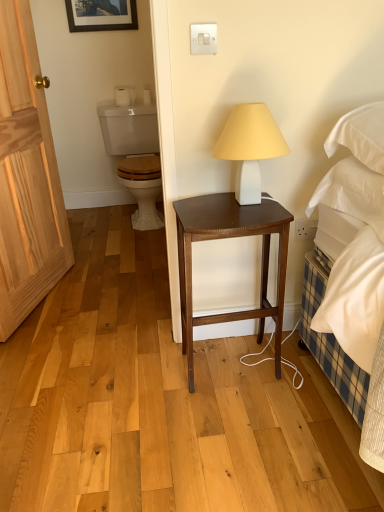
Locate an element on the screen. Image resolution: width=384 pixels, height=512 pixels. free location in front of dark wood stool at center is located at coordinates (246, 428).